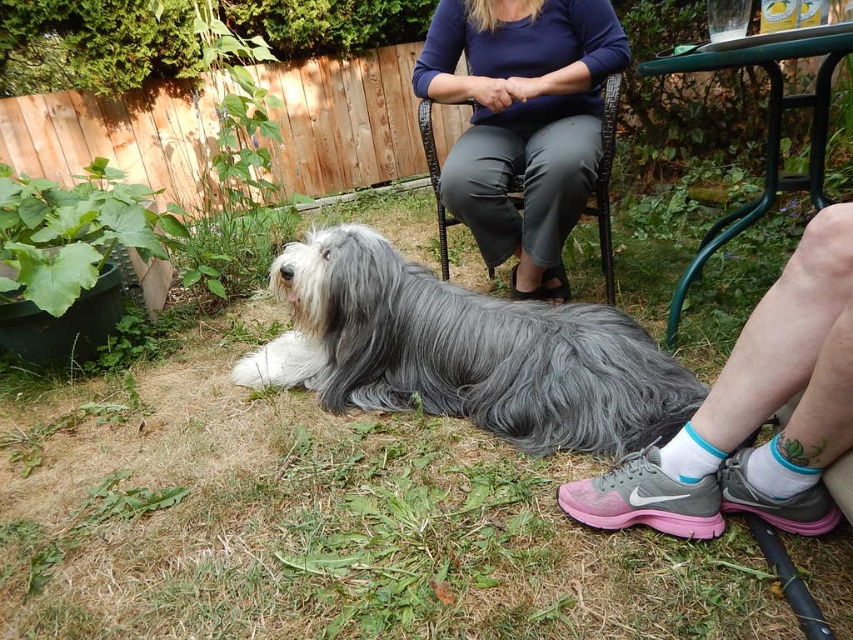
Is gray fluffy dog at center taller than woven wicker chair at center?

No.

Which of these two, gray fluffy dog at center or woven wicker chair at center, stands taller?

woven wicker chair at center

What do you see at coordinates (463, 352) in the screenshot? Image resolution: width=853 pixels, height=640 pixels. I see `gray fluffy dog at center` at bounding box center [463, 352].

You are a GUI agent. You are given a task and a screenshot of the screen. Output one action in this format:
    pyautogui.click(x=<x>, y=<y>)
    Task: Click on the gray fluffy dog at center
    This screenshot has height=640, width=853.
    Given the screenshot: What is the action you would take?
    pyautogui.click(x=463, y=352)

Can you confirm if pink mesh sneakers at lower right is shorter than woven wicker chair at center?

Yes, pink mesh sneakers at lower right is shorter than woven wicker chair at center.

Can you confirm if pink mesh sneakers at lower right is positioned below woven wicker chair at center?

Indeed, pink mesh sneakers at lower right is positioned under woven wicker chair at center.

Between point (657, 529) and point (439, 218), which one is positioned behind?

Positioned behind is point (439, 218).

Locate an element on the screen. pink mesh sneakers at lower right is located at coordinates (753, 413).

This screenshot has height=640, width=853. What do you see at coordinates (463, 352) in the screenshot?
I see `gray fluffy dog at center` at bounding box center [463, 352].

Does gray fluffy dog at center lie in front of pink mesh sneakers at lower right?

That is False.

What do you see at coordinates (463, 352) in the screenshot? I see `gray fluffy dog at center` at bounding box center [463, 352].

The image size is (853, 640). Identify the location of gray fluffy dog at center. (463, 352).